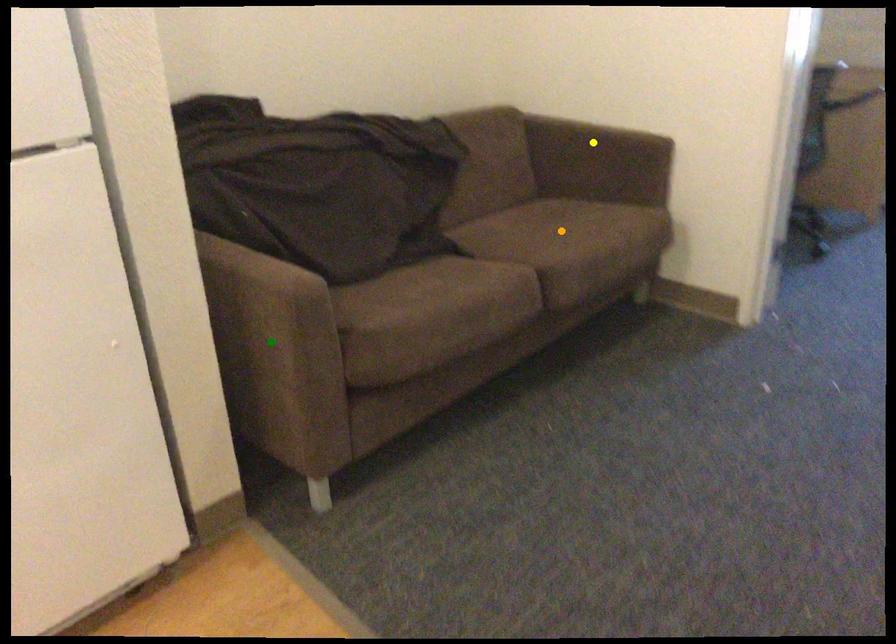
From the picture: Order these from nearest to farthest:
A) green point
B) orange point
C) yellow point

green point
orange point
yellow point